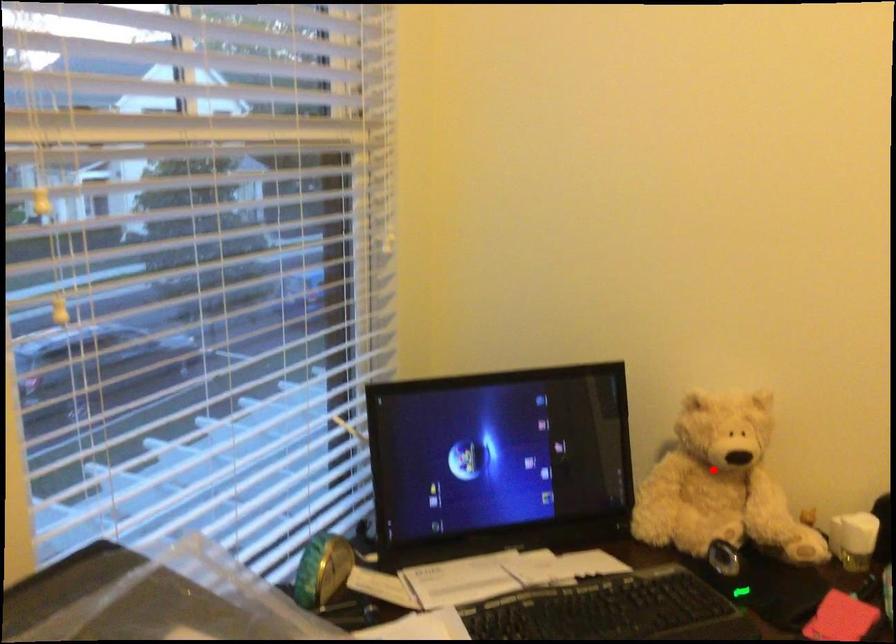
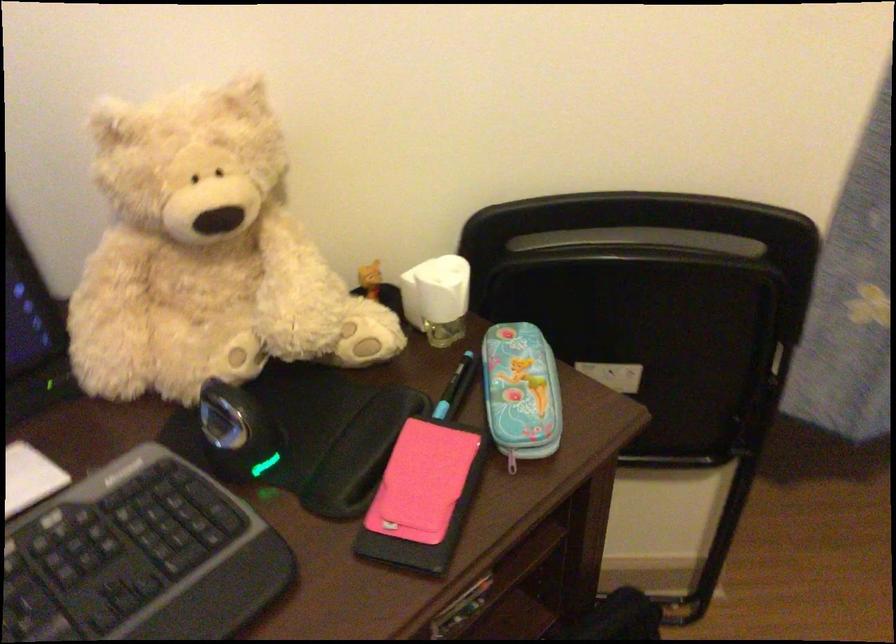
The point at the highlighted location is marked in the first image. Where is the corresponding point in the second image?

(205, 254)